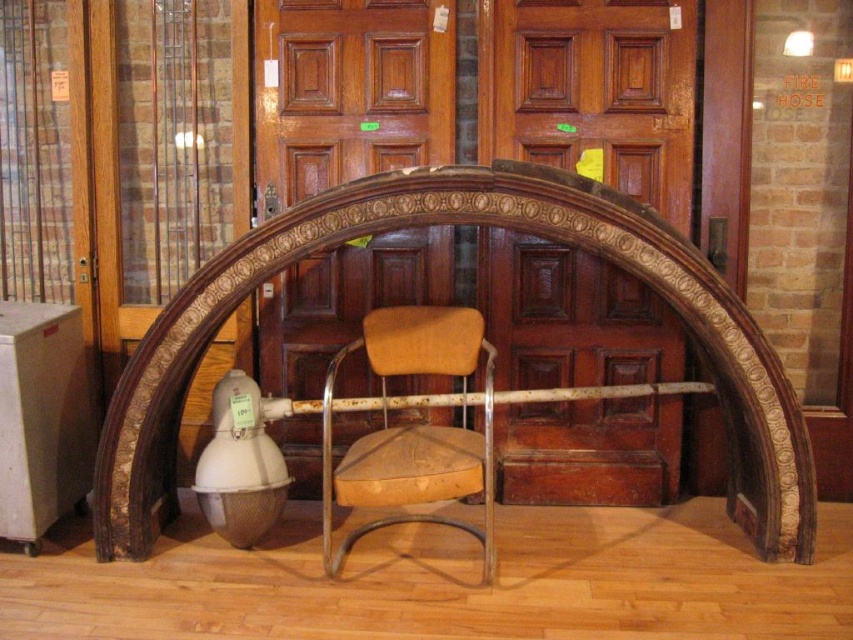
Question: Can you confirm if brown carved wood archway at center is positioned to the left of brown leather chair at center?

Choices:
 (A) no
 (B) yes

Answer: (A)

Question: Which of the following is the closest to the observer?

Choices:
 (A) (463, 396)
 (B) (689, 310)

Answer: (B)

Question: Observing the image, what is the correct spatial positioning of brown carved wood archway at center in reference to brown leather chair at center?

Choices:
 (A) below
 (B) above

Answer: (B)

Question: Can you confirm if brown carved wood archway at center is positioned to the right of brown leather chair at center?

Choices:
 (A) yes
 (B) no

Answer: (A)

Question: Which of the following is the closest to the observer?

Choices:
 (A) brown leather chair at center
 (B) brown carved wood archway at center

Answer: (A)